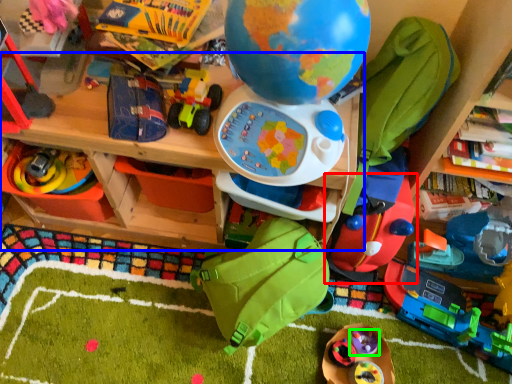
Question: Estimate the real-world distances between objects in this image. Which object is farther from toy (highlighted by a red box), table (highlighted by a blue box) or toy (highlighted by a green box)?

Choices:
 (A) table
 (B) toy

Answer: (A)